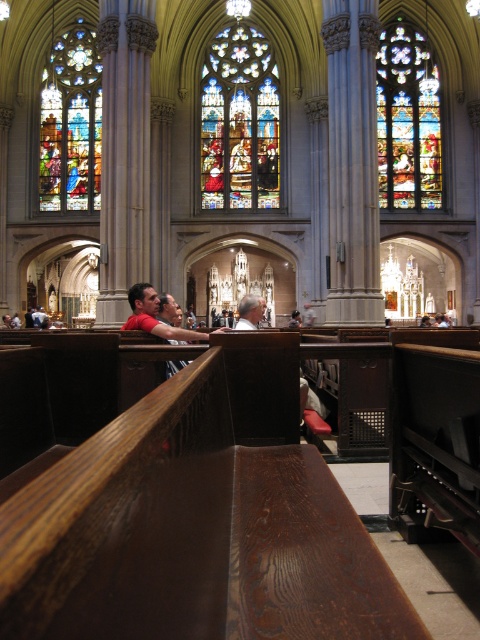
Question: Among these points, which one is nearest to the camera?

Choices:
 (A) (269, 97)
 (B) (429, 157)

Answer: (B)

Question: Can you confirm if multicolored stained glass at center is positioned below stained glass window at upper right?

Choices:
 (A) no
 (B) yes

Answer: (B)

Question: Which point appears farthest from the camera in this image?

Choices:
 (A) (60, 147)
 (B) (389, 189)

Answer: (A)

Question: Observing the image, what is the correct spatial positioning of multicolored stained glass at center in reference to stained glass window at upper left?

Choices:
 (A) right
 (B) left

Answer: (A)

Question: Which of these objects is positioned farthest from the stained glass window at upper left?

Choices:
 (A) multicolored stained glass at center
 (B) stained glass window at upper right

Answer: (B)

Question: Is multicolored stained glass at center to the right of stained glass window at upper left from the viewer's perspective?

Choices:
 (A) no
 (B) yes

Answer: (B)